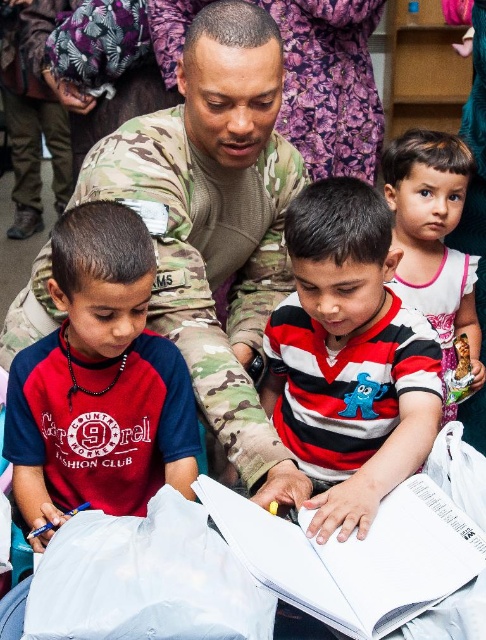
Who is shorter, striped cotton shirt at center or camo fabric uniform at center?

striped cotton shirt at center

What do you see at coordinates (349, 356) in the screenshot? I see `striped cotton shirt at center` at bounding box center [349, 356].

At what (x,y) coordinates should I click in order to perform the action: click on striped cotton shirt at center. Please return your answer as a coordinate pair (x, y). The image size is (486, 640). Looking at the image, I should click on (349, 356).

Can you confirm if matte red t-shirt at left is positioned below camo fabric uniform at center?

Yes, matte red t-shirt at left is below camo fabric uniform at center.

From the picture: Can you confirm if matte red t-shirt at left is smaller than camo fabric uniform at center?

Correct, matte red t-shirt at left occupies less space than camo fabric uniform at center.

What do you see at coordinates (99, 381) in the screenshot?
I see `matte red t-shirt at left` at bounding box center [99, 381].

I want to click on matte red t-shirt at left, so click(99, 381).

Is camo fabric uniform at center to the right of matte white shirt at upper right from the viewer's perspective?

No, camo fabric uniform at center is not to the right of matte white shirt at upper right.

Which is below, camo fabric uniform at center or matte white shirt at upper right?

matte white shirt at upper right

Does point (291, 76) lie in front of point (451, 161)?

That is False.

Where is `camo fabric uniform at center`? Image resolution: width=486 pixels, height=640 pixels. camo fabric uniform at center is located at coordinates (329, 83).